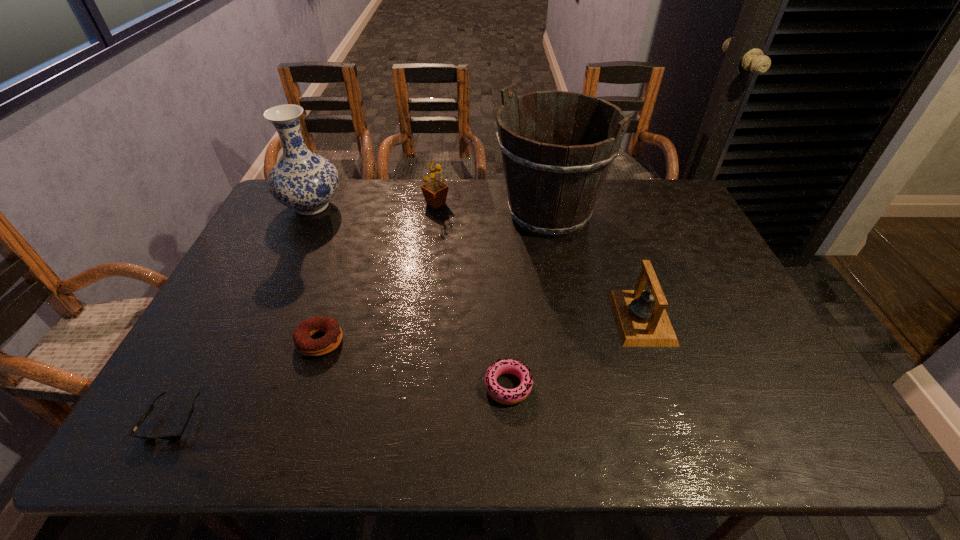
You are a GUI agent. You are given a task and a screenshot of the screen. Output one action in this format:
    pyautogui.click(x=<x>, y=<y>)
    Task: Click on the free location located 0.110m on the right of the bucket
    
    Given the screenshot: What is the action you would take?
    pyautogui.click(x=637, y=214)

I want to click on free space located 0.060m on the right of the vase, so click(x=362, y=206).

Find the location of `free location located at the front of the sunflower with flowers visible`. free location located at the front of the sunflower with flowers visible is located at coordinates (547, 204).

Image resolution: width=960 pixels, height=540 pixels. Identify the location of vacant point located 0.140m on the back of the bell. (621, 259).

This screenshot has height=540, width=960. I want to click on vacant space situated on the left of the farther doughnut, so (x=237, y=341).

In order to click on vacant space located on the left of the sixth tallest object in this screenshot , I will do `click(319, 386)`.

Where is `bucket that is at the far edge`? This screenshot has height=540, width=960. bucket that is at the far edge is located at coordinates (552, 187).

Identify the location of vase present at the far edge. The height and width of the screenshot is (540, 960). (302, 180).

You are a GUI agent. You are given a task and a screenshot of the screen. Output one action in this format:
    pyautogui.click(x=<x>, y=<y>)
    Task: Click on the sunflower at the far edge
    
    Given the screenshot: What is the action you would take?
    pyautogui.click(x=435, y=192)

Image resolution: width=960 pixels, height=540 pixels. Identify the location of object that is at the near edge. (175, 436).